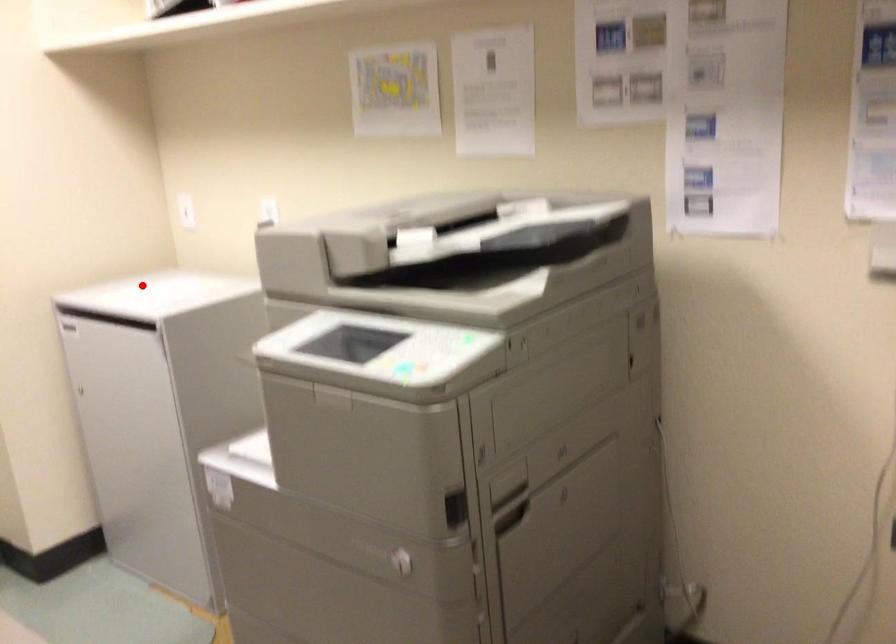
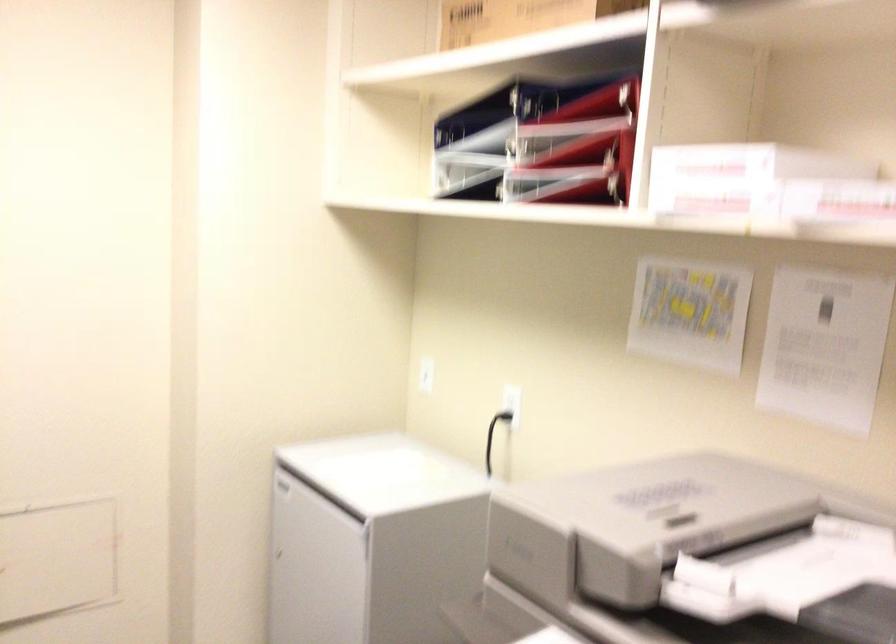
Where in the second image is the point corresponding to the highlighted location from the first image?

(359, 456)